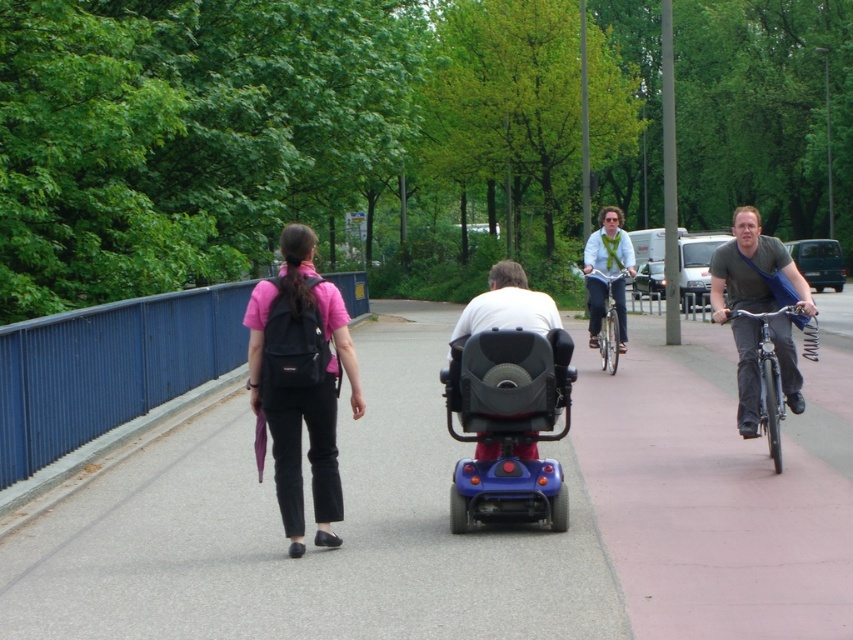
You are a pedestrian walking on the pathway and want to pass by both the matte black scooter at center and the shiny silver bicycle at right. Which object should you avoid stepping on to stay safe?

The matte black scooter at center is positioned over the shiny silver bicycle at right, meaning it is closer to you. To stay safe, avoid stepping on the matte black scooter at center as it is in your path.

You are a pedestrian walking on the pathway and need to pass between the matte black scooter at center and the shiny silver bicycle at right. What is the minimum distance you should maintain between them to ensure safe passage?

The minimum distance you should maintain between the matte black scooter at center and the shiny silver bicycle at right is 6.83 feet to ensure safe passage.